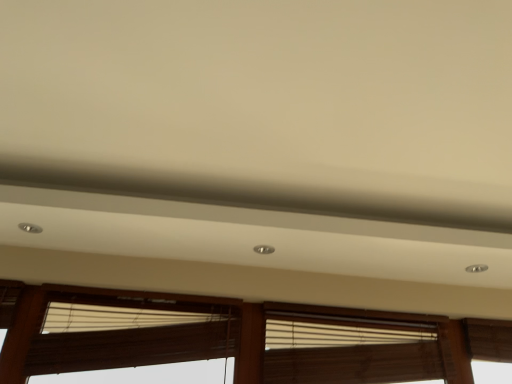
What do you see at coordinates (234, 337) in the screenshot?
I see `wooden blinds at lower center` at bounding box center [234, 337].

Measure the distance between brown fabric window blind at lower center, which is the second window blind in right-to-left order, and camera.

The distance of brown fabric window blind at lower center, which is the second window blind in right-to-left order, from camera is 6.39 feet.

At what (x,y) coordinates should I click in order to perform the action: click on wooden blinds at lower center. Please return your answer as a coordinate pair (x, y). The width and height of the screenshot is (512, 384). Looking at the image, I should click on (234, 337).

Can you confirm if brown fabric window blind at lower center, which ranks as the first window blind in left-to-right order, is shorter than wooden blinds at lower center?

Yes, brown fabric window blind at lower center, which ranks as the first window blind in left-to-right order, is shorter than wooden blinds at lower center.

From the image's perspective, between brown fabric window blind at lower center, which ranks as the first window blind in left-to-right order, and wooden blinds at lower center, who is located below?

From the image's view, wooden blinds at lower center is below.

Based on the photo, does brown fabric window blind at lower center, which is the second window blind in right-to-left order, touch wooden blinds at lower center?

No, brown fabric window blind at lower center, which is the second window blind in right-to-left order, is not next to wooden blinds at lower center.

Can you tell me how much brown fabric window blind at lower center, which ranks as the first window blind in left-to-right order, and wooden blinds at lower center differ in facing direction?

They differ by 1.12 degrees in their facing directions.

Is brown fabric window blind at lower center, which is the second window blind in right-to-left order, wider or thinner than wooden blinds at center, the second window blind in the left-to-right sequence?

Considering their sizes, brown fabric window blind at lower center, which is the second window blind in right-to-left order, looks slimmer than wooden blinds at center, the second window blind in the left-to-right sequence.

Is brown fabric window blind at lower center, which is the second window blind in right-to-left order, turned away from wooden blinds at center, the second window blind in the left-to-right sequence?

brown fabric window blind at lower center, which is the second window blind in right-to-left order, does not have its back to wooden blinds at center, the second window blind in the left-to-right sequence.

What are the coordinates of `window blind to the left of wooden blinds at center, which ranks as the first window blind in right-to-left order` in the screenshot? It's located at [129, 334].

Can we say brown fabric window blind at lower center, which is the second window blind in right-to-left order, lies outside wooden blinds at center, the second window blind in the left-to-right sequence?

brown fabric window blind at lower center, which is the second window blind in right-to-left order, is positioned outside wooden blinds at center, the second window blind in the left-to-right sequence.

Which object is positioned more to the left, wooden blinds at center, the second window blind in the left-to-right sequence, or brown fabric window blind at lower center, which is the second window blind in right-to-left order?

brown fabric window blind at lower center, which is the second window blind in right-to-left order.

Consider the image. Is wooden blinds at center, the second window blind in the left-to-right sequence, directly adjacent to brown fabric window blind at lower center, which is the second window blind in right-to-left order?

No, wooden blinds at center, the second window blind in the left-to-right sequence, is not beside brown fabric window blind at lower center, which is the second window blind in right-to-left order.

From their relative heights in the image, would you say wooden blinds at center, the second window blind in the left-to-right sequence, is taller or shorter than brown fabric window blind at lower center, which is the second window blind in right-to-left order?

In the image, wooden blinds at center, the second window blind in the left-to-right sequence, appears to be taller than brown fabric window blind at lower center, which is the second window blind in right-to-left order.

Visually, is wooden blinds at center, the second window blind in the left-to-right sequence, positioned to the left or to the right of wooden blinds at lower center?

wooden blinds at center, the second window blind in the left-to-right sequence, is to the right of wooden blinds at lower center.

Consider the image. Can you confirm if wooden blinds at center, the second window blind in the left-to-right sequence, is taller than wooden blinds at lower center?

In fact, wooden blinds at center, the second window blind in the left-to-right sequence, may be shorter than wooden blinds at lower center.

Is wooden blinds at center, which ranks as the first window blind in right-to-left order, positioned before wooden blinds at lower center?

That is False.

From the image's perspective, which one is positioned higher, wooden blinds at center, the second window blind in the left-to-right sequence, or wooden blinds at lower center?

From the image's view, wooden blinds at center, the second window blind in the left-to-right sequence, is above.

From a real-world perspective, between wooden blinds at lower center and wooden blinds at center, the second window blind in the left-to-right sequence, who is vertically lower?

wooden blinds at lower center is physically lower.

Who is shorter, wooden blinds at lower center or wooden blinds at center, which ranks as the first window blind in right-to-left order?

Standing shorter between the two is wooden blinds at center, which ranks as the first window blind in right-to-left order.

I want to click on window located in front of the wooden blinds at center, which ranks as the first window blind in right-to-left order, so click(234, 337).

Is point (432, 344) farther from camera compared to point (285, 317)?

Yes.

Is wooden blinds at lower center wider or thinner than brown fabric window blind at lower center, which ranks as the first window blind in left-to-right order?

In the image, wooden blinds at lower center appears to be more narrow than brown fabric window blind at lower center, which ranks as the first window blind in left-to-right order.

Is wooden blinds at lower center inside the boundaries of brown fabric window blind at lower center, which ranks as the first window blind in left-to-right order, or outside?

wooden blinds at lower center lies outside brown fabric window blind at lower center, which ranks as the first window blind in left-to-right order.

Considering the relative sizes of wooden blinds at lower center and brown fabric window blind at lower center, which ranks as the first window blind in left-to-right order, in the image provided, is wooden blinds at lower center shorter than brown fabric window blind at lower center, which ranks as the first window blind in left-to-right order,?

Incorrect, the height of wooden blinds at lower center does not fall short of that of brown fabric window blind at lower center, which ranks as the first window blind in left-to-right order.

Is point (463, 374) less distant than point (124, 356)?

No, (463, 374) is behind (124, 356).

Identify the location of window above the brown fabric window blind at lower center, which ranks as the first window blind in left-to-right order (from a real-world perspective). This screenshot has width=512, height=384. (234, 337).

What are the coordinates of `window blind on the right of brown fabric window blind at lower center, which ranks as the first window blind in left-to-right order` in the screenshot? It's located at (348, 350).

Which object lies further to the anchor point wooden blinds at lower center, brown fabric window blind at lower center, which is the second window blind in right-to-left order, or wooden blinds at center, the second window blind in the left-to-right sequence?

The object further to wooden blinds at lower center is wooden blinds at center, the second window blind in the left-to-right sequence.

Looking at the image, which one is located further to wooden blinds at center, which ranks as the first window blind in right-to-left order, brown fabric window blind at lower center, which is the second window blind in right-to-left order, or wooden blinds at lower center?

brown fabric window blind at lower center, which is the second window blind in right-to-left order, is further to wooden blinds at center, which ranks as the first window blind in right-to-left order.

From the image, which object appears to be nearer to wooden blinds at center, the second window blind in the left-to-right sequence, wooden blinds at lower center or brown fabric window blind at lower center, which is the second window blind in right-to-left order?

The object closer to wooden blinds at center, the second window blind in the left-to-right sequence, is wooden blinds at lower center.

Considering their positions, is wooden blinds at center, the second window blind in the left-to-right sequence, positioned closer to wooden blinds at lower center than brown fabric window blind at lower center, which is the second window blind in right-to-left order?

brown fabric window blind at lower center, which is the second window blind in right-to-left order, is closer to wooden blinds at lower center.

From the image, which object appears to be nearer to brown fabric window blind at lower center, which is the second window blind in right-to-left order, wooden blinds at center, the second window blind in the left-to-right sequence, or wooden blinds at lower center?

The object closer to brown fabric window blind at lower center, which is the second window blind in right-to-left order, is wooden blinds at lower center.

Considering their positions, is wooden blinds at lower center positioned closer to brown fabric window blind at lower center, which is the second window blind in right-to-left order, than wooden blinds at center, which ranks as the first window blind in right-to-left order?

The object closer to brown fabric window blind at lower center, which is the second window blind in right-to-left order, is wooden blinds at lower center.

This screenshot has height=384, width=512. What are the coordinates of `window between brown fabric window blind at lower center, which is the second window blind in right-to-left order, and wooden blinds at center, which ranks as the first window blind in right-to-left order` in the screenshot? It's located at (234, 337).